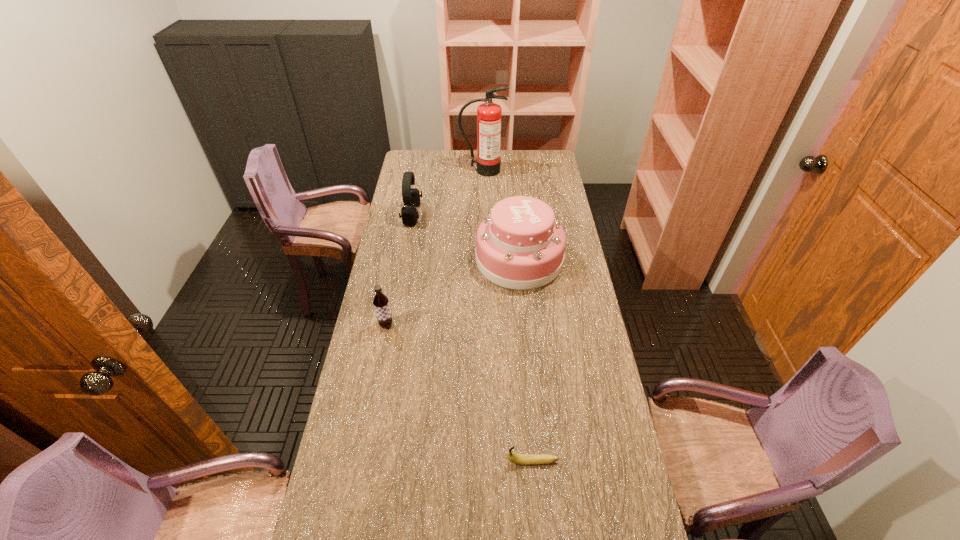
Where is `free location at the right edge`? This screenshot has width=960, height=540. free location at the right edge is located at coordinates (572, 241).

The width and height of the screenshot is (960, 540). Identify the location of vacant region at the far right corner of the desktop. (552, 160).

You are a GUI agent. You are given a task and a screenshot of the screen. Output one action in this format:
    pyautogui.click(x=<x>, y=<y>)
    Task: Click on the free spot between the headset and the shortest object
    This screenshot has width=960, height=540.
    Given the screenshot: What is the action you would take?
    pyautogui.click(x=472, y=338)

The width and height of the screenshot is (960, 540). I want to click on free space between the banana and the farthest object, so click(x=508, y=316).

Find the location of a particular element. The image size is (960, 540). unoccupied area between the nearest object and the fire extinguisher is located at coordinates (508, 316).

This screenshot has height=540, width=960. Identify the location of vacant area between the second nearest object and the cake. (452, 292).

Locate an element on the screen. free spot between the fourth nearest object and the second nearest object is located at coordinates (399, 269).

You are a GUI agent. You are given a task and a screenshot of the screen. Output one action in this format:
    pyautogui.click(x=<x>, y=<y>)
    Task: Click on the free space between the headset and the tallest object
    This screenshot has height=540, width=960.
    Given the screenshot: What is the action you would take?
    pyautogui.click(x=447, y=192)

Identify the location of object that is the third closest to the root beer. (522, 459).

This screenshot has width=960, height=540. Find the location of `the second closest object relative to the headset`. the second closest object relative to the headset is located at coordinates (489, 115).